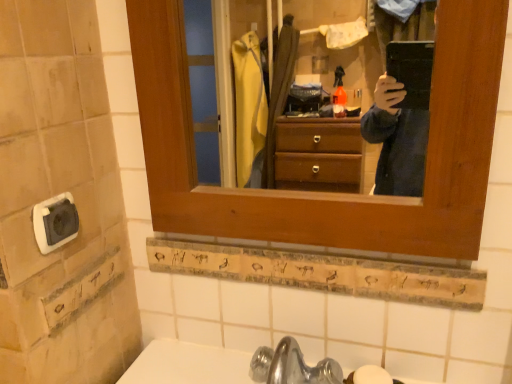
Question: Looking at the image, does white plastic outlet at lower left seem bigger or smaller compared to white matte soap at lower center?

Choices:
 (A) big
 (B) small

Answer: (A)

Question: Is point (70, 205) positioned closer to the camera than point (361, 380)?

Choices:
 (A) farther
 (B) closer

Answer: (B)

Question: Considering the relative positions of white plastic outlet at lower left and white matte soap at lower center in the image provided, is white plastic outlet at lower left to the left or to the right of white matte soap at lower center?

Choices:
 (A) right
 (B) left

Answer: (B)

Question: Considering their positions, is white matte soap at lower center located in front of or behind white plastic outlet at lower left?

Choices:
 (A) behind
 (B) front

Answer: (A)

Question: From the image's perspective, is white matte soap at lower center above or below white plastic outlet at lower left?

Choices:
 (A) below
 (B) above

Answer: (A)

Question: Considering the positions of white matte soap at lower center and white plastic outlet at lower left in the image, is white matte soap at lower center bigger or smaller than white plastic outlet at lower left?

Choices:
 (A) small
 (B) big

Answer: (A)

Question: In terms of width, does white matte soap at lower center look wider or thinner when compared to white plastic outlet at lower left?

Choices:
 (A) wide
 (B) thin

Answer: (A)